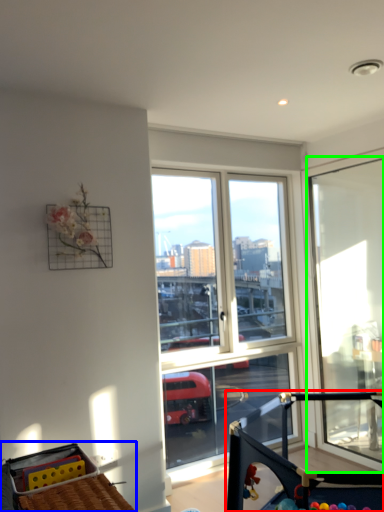
Question: Considering the real-world distances, which object is farthest from baby carriage (highlighted by a red box)? baby carriage (highlighted by a blue box) or window (highlighted by a green box)?

Choices:
 (A) baby carriage
 (B) window

Answer: (B)